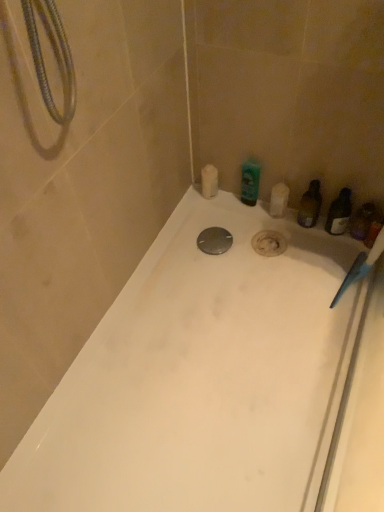
The width and height of the screenshot is (384, 512). In order to click on vacant area that lies between translucent plastic bottle at right, marked as the second toiletry in a right-to-left arrangement, and green glossy bottle at upper right, the second toiletry viewed from the left in this screenshot , I will do `click(273, 218)`.